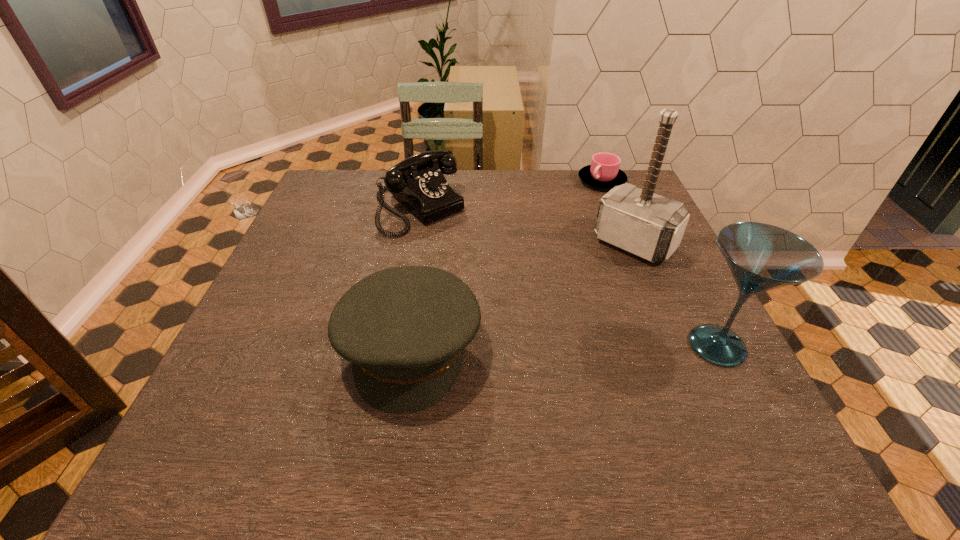
You are a GUI agent. You are given a task and a screenshot of the screen. Output one action in this format:
    pyautogui.click(x=<x>, y=<y>)
    Task: Click on the free region located for striking with the head of the hammer
    This screenshot has height=540, width=960.
    Given the screenshot: What is the action you would take?
    pyautogui.click(x=547, y=329)

In order to click on vacant space positioned 0.120m for striking with the head of the hammer in this screenshot , I will do point(590,286).

At what (x,y) coordinates should I click in order to perform the action: click on vacant region located on the side with the handle of the shortest object. Please return your answer as a coordinate pair (x, y). The width and height of the screenshot is (960, 540). Looking at the image, I should click on (581, 243).

This screenshot has height=540, width=960. Find the location of `free space located on the side with the handle of the shortest object`. free space located on the side with the handle of the shortest object is located at coordinates (583, 237).

This screenshot has width=960, height=540. In order to click on vacant space situated on the side with the handle of the shortest object in this screenshot , I will do `click(594, 202)`.

The width and height of the screenshot is (960, 540). In order to click on telephone at the far edge in this screenshot , I will do `click(418, 182)`.

Where is `cup that is at the far edge`? Image resolution: width=960 pixels, height=540 pixels. cup that is at the far edge is located at coordinates (604, 172).

Image resolution: width=960 pixels, height=540 pixels. Identify the location of beret that is at the near edge. (404, 329).

I want to click on martini present at the near edge, so click(761, 257).

Where is `martini at the right edge`? The image size is (960, 540). martini at the right edge is located at coordinates (761, 257).